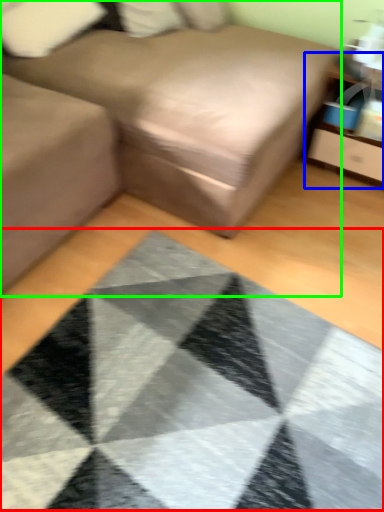
Question: Considering the real-world distances, which object is farthest from mat (highlighted by a red box)? dresser (highlighted by a blue box) or studio couch (highlighted by a green box)?

Choices:
 (A) dresser
 (B) studio couch

Answer: (A)